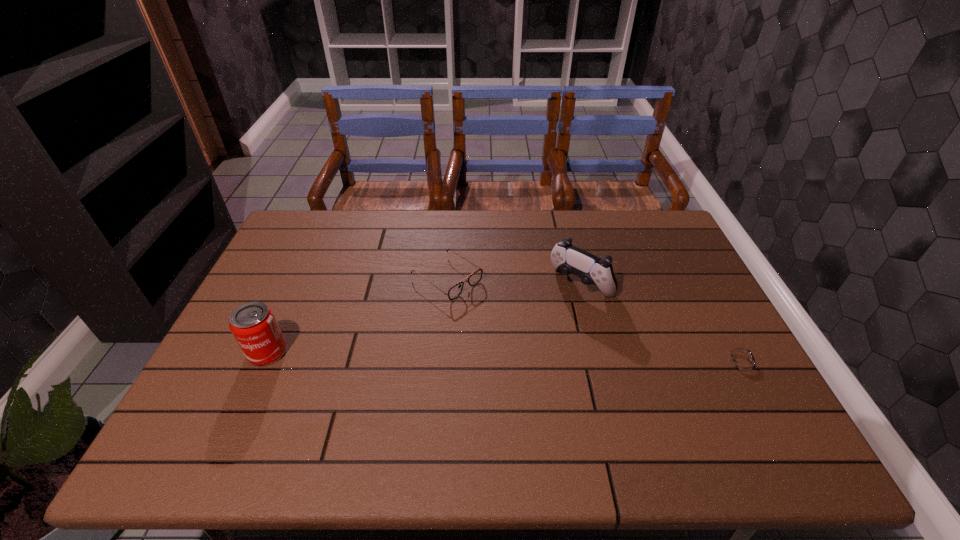
Locate an element on the screen. The image size is (960, 540). object that is the third nearest to the third object from left to right is located at coordinates (254, 326).

The height and width of the screenshot is (540, 960). I want to click on the third closest object relative to the leftmost object, so coord(738,359).

Find the location of a particular element. The image size is (960, 540). vacant space that satisfies the following two spatial constraints: 1. on the front side of the shortest object; 2. on the face of the third object from left to right is located at coordinates (599, 360).

Find the location of a particular element. The image size is (960, 540). free spot that satisfies the following two spatial constraints: 1. on the front side of the rightmost object; 2. on the face of the second shortest object is located at coordinates (441, 360).

You are a GUI agent. You are given a task and a screenshot of the screen. Output one action in this format:
    pyautogui.click(x=<x>, y=<y>)
    Task: Click on the free space that satisfies the following two spatial constraints: 1. on the back side of the sunglasses; 2. on the left side of the can
    This screenshot has height=540, width=960.
    Given the screenshot: What is the action you would take?
    pyautogui.click(x=300, y=278)